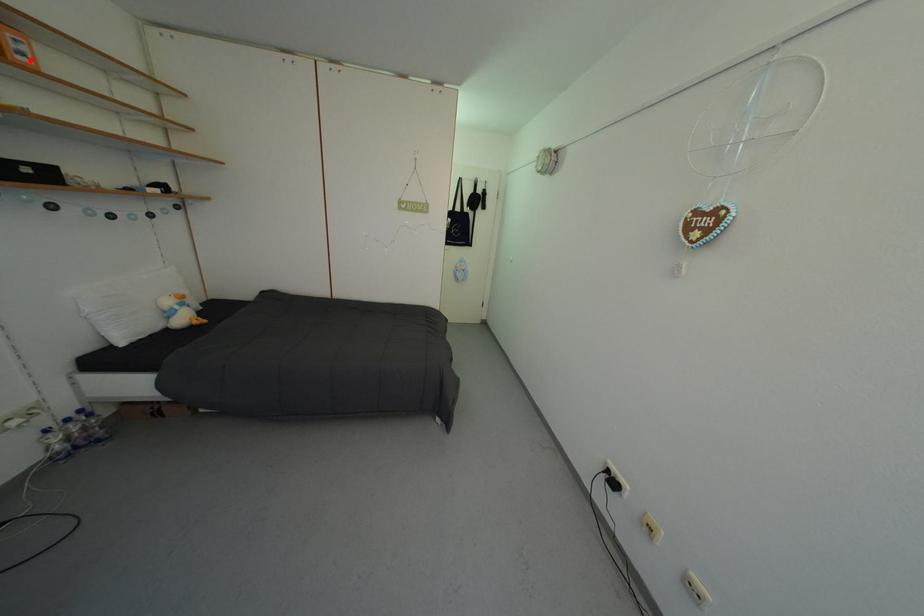
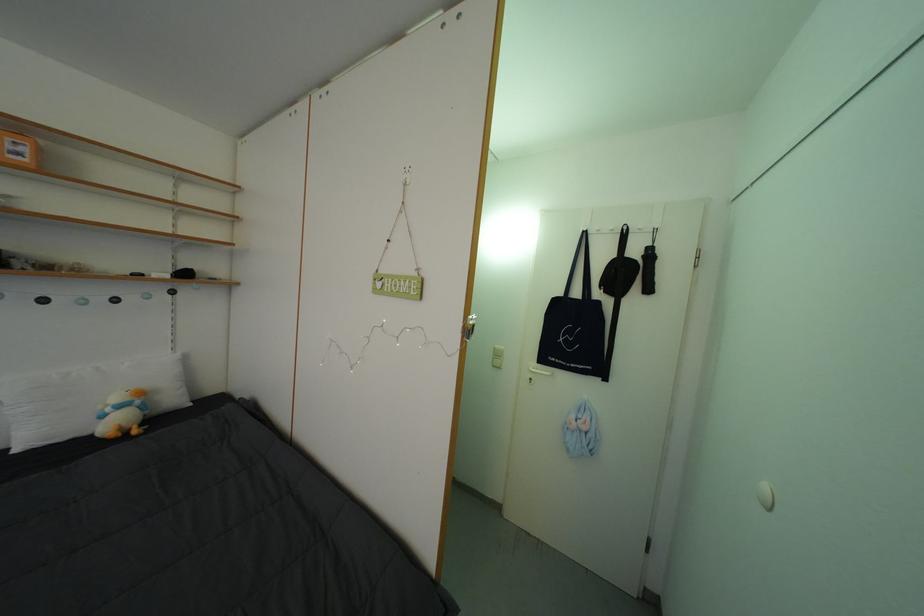
The point at the highlighted location is marked in the first image. Where is the corresponding point in the second image?

(27, 160)